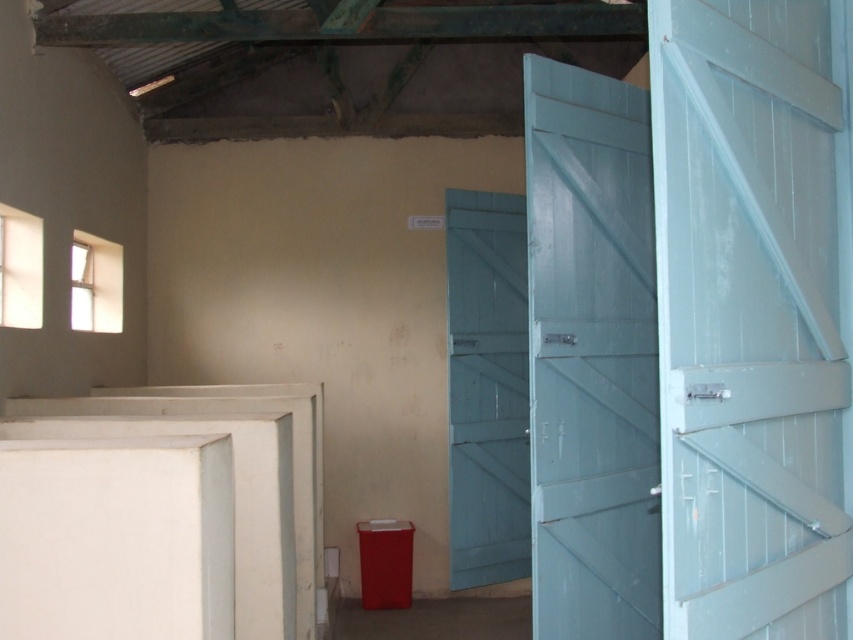
Is light blue wooden door at right in front of light blue wooden door at center?

Yes, light blue wooden door at right is in front of light blue wooden door at center.

Does light blue wooden door at right have a smaller size compared to light blue wooden door at center?

No.

What do you see at coordinates (590, 356) in the screenshot? I see `light blue wooden door at right` at bounding box center [590, 356].

What are the coordinates of `light blue wooden door at right` in the screenshot? It's located at (590, 356).

Can you confirm if white painted wood door at right is positioned below light blue wooden door at center?

No.

Is the position of white painted wood door at right more distant than that of light blue wooden door at center?

No, white painted wood door at right is closer to the viewer.

Between point (828, 141) and point (451, 232), which one is positioned in front?

Point (828, 141) is in front.

The width and height of the screenshot is (853, 640). Find the location of `white painted wood door at right`. white painted wood door at right is located at coordinates (749, 320).

Is white painted wood door at right below light blue wooden door at right?

No.

Is white painted wood door at right to the left of light blue wooden door at right from the viewer's perspective?

In fact, white painted wood door at right is to the right of light blue wooden door at right.

Is point (711, 65) behind point (630, 196)?

No, (711, 65) is closer to viewer.

What are the coordinates of `white painted wood door at right` in the screenshot? It's located at (749, 320).